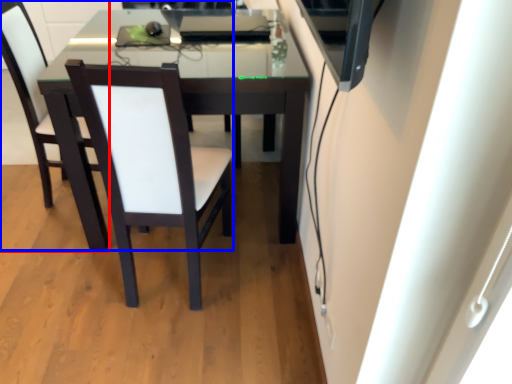
Question: Among these objects, which one is farthest to the camera, chair (highlighted by a red box) or chair (highlighted by a blue box)?

Choices:
 (A) chair
 (B) chair

Answer: (A)